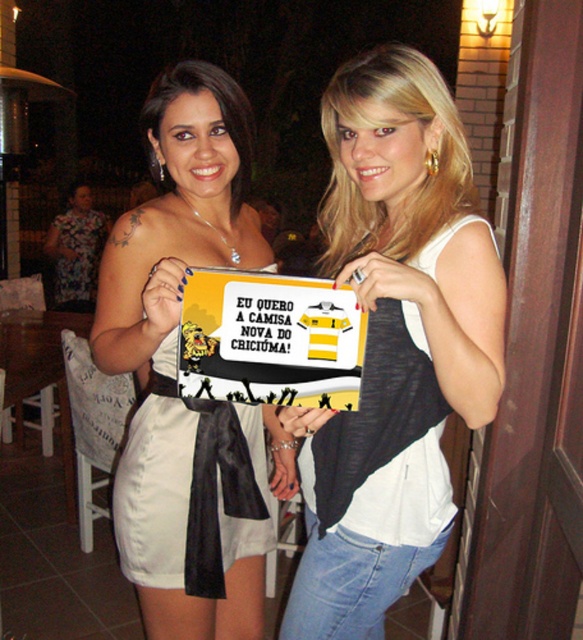
Does white satin dress at center have a lesser height compared to floral fabric dress at left?

Indeed, white satin dress at center has a lesser height compared to floral fabric dress at left.

Can you confirm if white satin dress at center is positioned to the left of floral fabric dress at left?

Incorrect, white satin dress at center is not on the left side of floral fabric dress at left.

Is point (180, 445) positioned after point (55, 230)?

No.

This screenshot has height=640, width=583. Find the location of `white satin dress at center`. white satin dress at center is located at coordinates (189, 486).

Who is shorter, matte white dress at center or white satin dress at center?

white satin dress at center is shorter.

Can you confirm if matte white dress at center is shorter than white satin dress at center?

In fact, matte white dress at center may be taller than white satin dress at center.

Describe the element at coordinates (175, 371) in the screenshot. I see `matte white dress at center` at that location.

Locate an element on the screen. matte white dress at center is located at coordinates (175, 371).

Which is behind, point (374, 632) or point (238, 499)?

The point (374, 632) is more distant.

From the picture: Can you confirm if yellow and black jersey at center is positioned to the left of white satin dress at center?

Incorrect, yellow and black jersey at center is not on the left side of white satin dress at center.

Is point (441, 365) positioned in front of point (199, 458)?

Yes.

Find the location of a particular element. The height and width of the screenshot is (640, 583). yellow and black jersey at center is located at coordinates (395, 342).